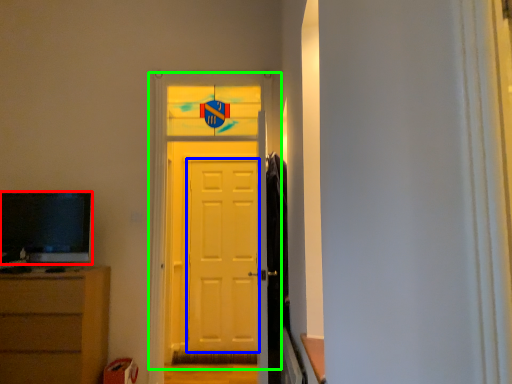
Question: Which object is positioned farthest from television (highlighted by a red box)? Select from screen door (highlighted by a blue box) and door (highlighted by a green box).

Choices:
 (A) screen door
 (B) door

Answer: (A)